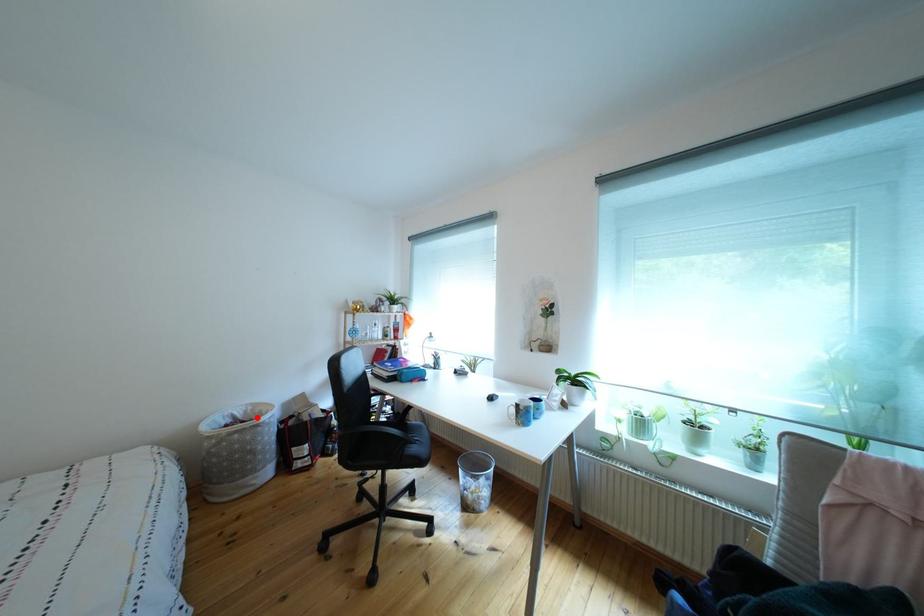
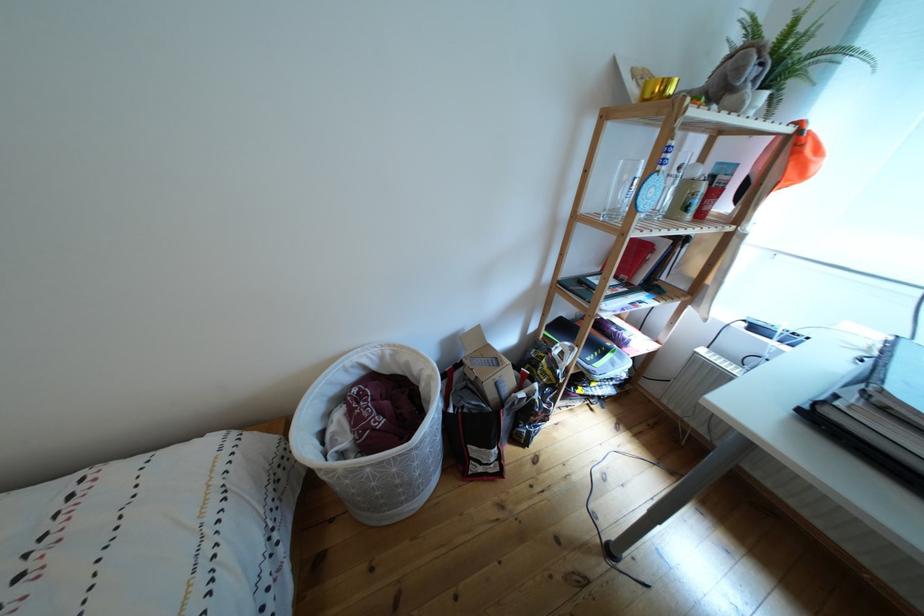
The point at the highlighted location is marked in the first image. Where is the corresponding point in the second image?

(393, 363)